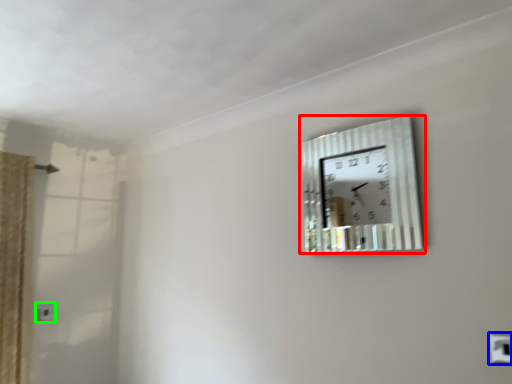
Question: Based on their relative distances, which object is farther from wall clock (highlighted by a red box)? Choose from electric outlet (highlighted by a blue box) and electric outlet (highlighted by a green box).

Choices:
 (A) electric outlet
 (B) electric outlet

Answer: (B)